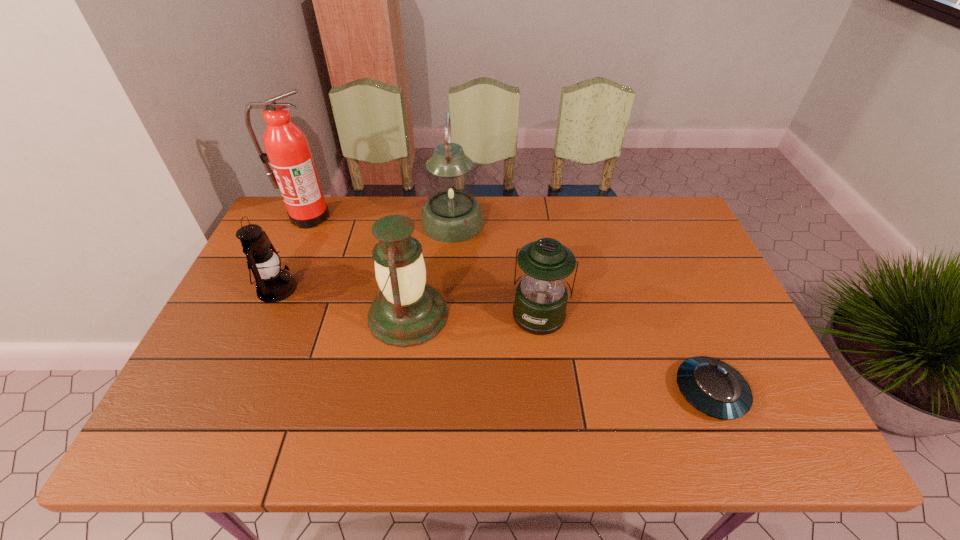
Image resolution: width=960 pixels, height=540 pixels. I want to click on the tallest object, so click(293, 171).

The height and width of the screenshot is (540, 960). What are the coordinates of `the tallest lantern` in the screenshot? It's located at (451, 214).

Find the location of a particular element. the farthest lantern is located at coordinates (451, 214).

Locate an element on the screen. the fourth shortest object is located at coordinates (407, 312).

Find the location of a particular element. the leftmost lantern is located at coordinates (273, 284).

Image resolution: width=960 pixels, height=540 pixels. What are the coordinates of `the rightmost lantern` in the screenshot? It's located at (541, 297).

The height and width of the screenshot is (540, 960). I want to click on saucer, so click(713, 387).

Find the location of a particular element. the shortest object is located at coordinates (713, 387).

Find the location of `free space located on the label side of the tallest object`. free space located on the label side of the tallest object is located at coordinates (262, 317).

What are the coordinates of `free space located on the right of the farthest lantern` in the screenshot? It's located at (511, 223).